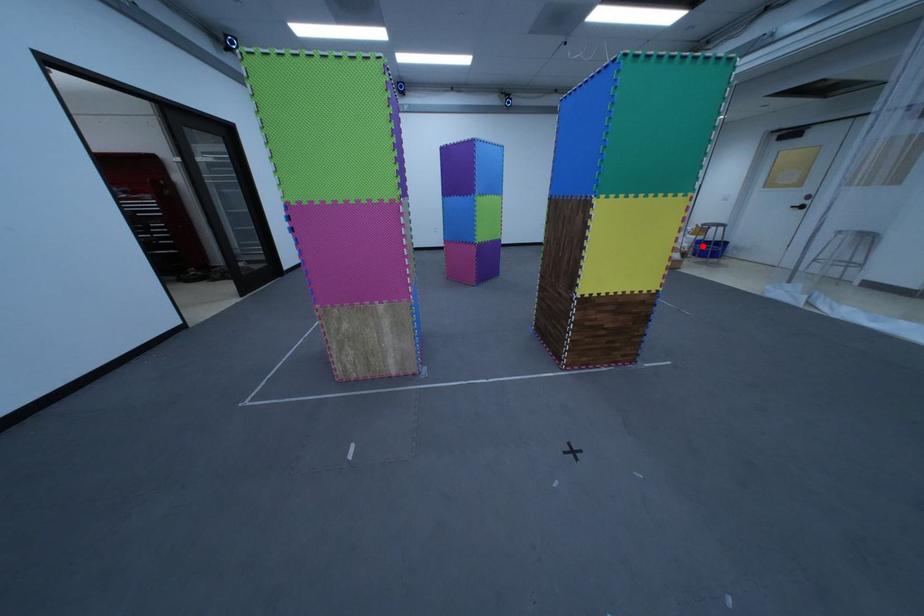
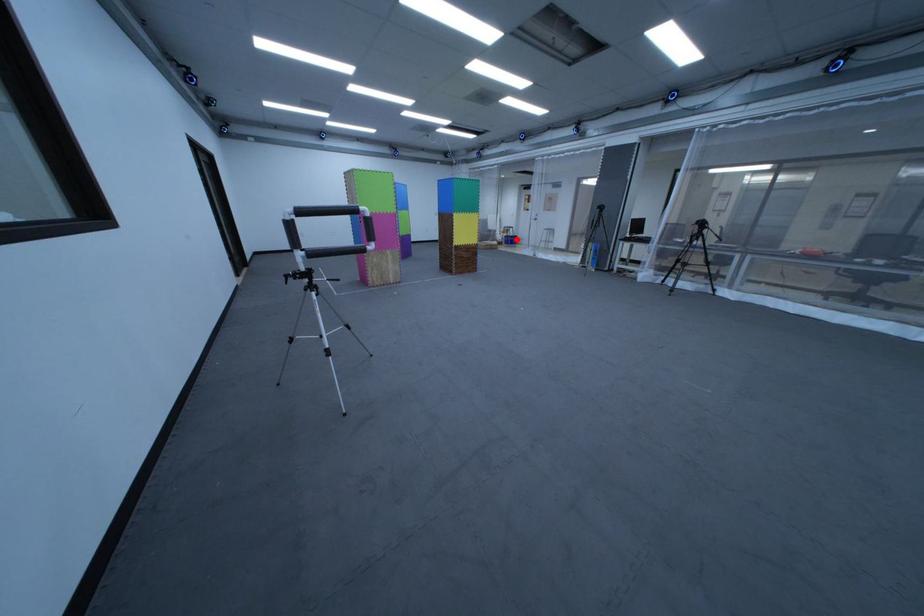
Based on the photo, I am providing you with two images of the same scene from different viewpoints. A red point is marked on the first image and another point is marked on the second image. Is the red point in image1 aligned with the point shown in image2?

Yes